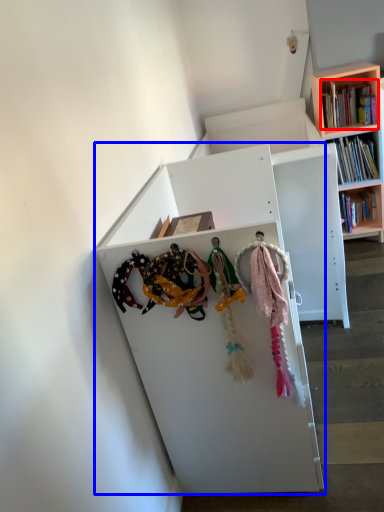
Question: Which of the following is the closest to the observer, book (highlighted by a red box) or shelf (highlighted by a blue box)?

Choices:
 (A) book
 (B) shelf

Answer: (B)